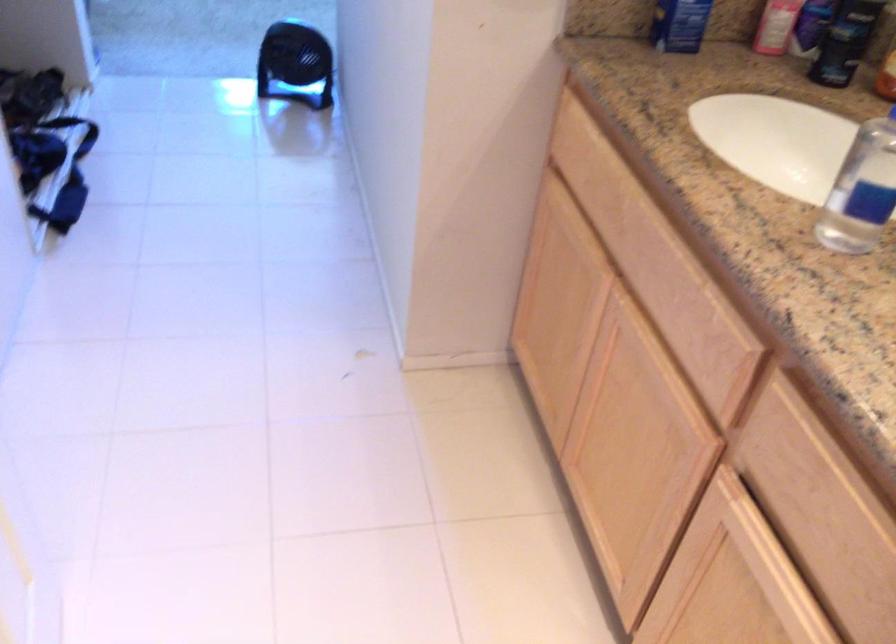
Where is `blue box`? The width and height of the screenshot is (896, 644). blue box is located at coordinates (679, 24).